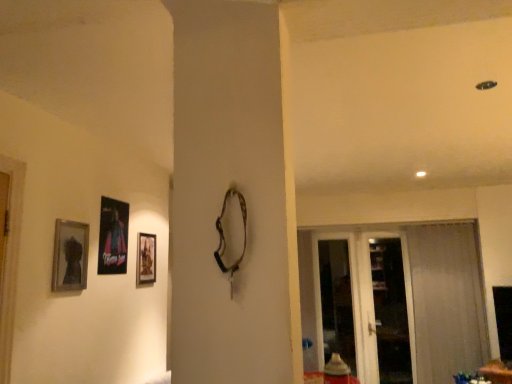
Question: In the image, is transparent glass screen door at right, which ranks as the 1th screen door in right-to-left order, positioned in front of or behind metallic poster at left, which appears as the 2th picture frame when viewed from the front?

Choices:
 (A) front
 (B) behind

Answer: (B)

Question: Considering the relative positions of transparent glass screen door at right, the 2th screen door viewed from the left, and metallic poster at left, placed as the 2th picture frame when sorted from right to left, in the image provided, is transparent glass screen door at right, the 2th screen door viewed from the left, to the left or to the right of metallic poster at left, placed as the 2th picture frame when sorted from right to left,?

Choices:
 (A) right
 (B) left

Answer: (A)

Question: Which object is positioned farthest from the metallic poster at left, placed as the 2th picture frame when sorted from back to front?

Choices:
 (A) sheer white curtain at right
 (B) transparent glass screen door at right, the 2th screen door viewed from the left
 (C) matte black picture frame at left, which is the 3th picture frame from back to front
 (D) matte wooden picture frame at center, which is the 3th picture frame from front to back
 (E) transparent glass screen door at right, marked as the first screen door in a left-to-right arrangement

Answer: (A)

Question: Estimate the real-world distances between objects in this image. Which object is farther from the metallic poster at left, which appears as the 2th picture frame when viewed from the front?

Choices:
 (A) transparent glass screen door at right, which ranks as the 1th screen door in right-to-left order
 (B) transparent glass screen door at right, acting as the second screen door starting from the right
 (C) matte black picture frame at left, the first picture frame in the front-to-back sequence
 (D) sheer white curtain at right
 (E) matte wooden picture frame at center, the first picture frame viewed from the back

Answer: (D)